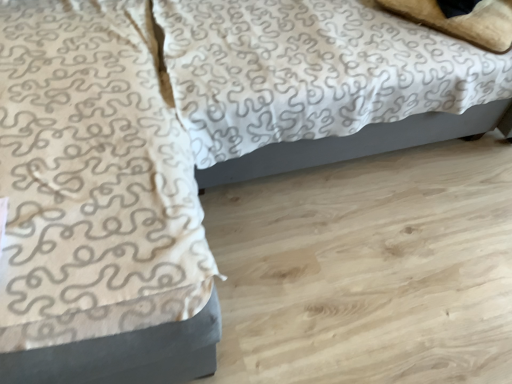
Question: Is white textured fabric at center at the back of beige soft pillow at upper right?

Choices:
 (A) yes
 (B) no

Answer: (A)

Question: Does beige soft pillow at upper right have a smaller size compared to white textured fabric at center?

Choices:
 (A) no
 (B) yes

Answer: (B)

Question: Considering the relative sizes of beige soft pillow at upper right and white textured fabric at center in the image provided, is beige soft pillow at upper right wider than white textured fabric at center?

Choices:
 (A) no
 (B) yes

Answer: (A)

Question: From a real-world perspective, is beige soft pillow at upper right on white textured fabric at center?

Choices:
 (A) yes
 (B) no

Answer: (A)

Question: From a real-world perspective, does beige soft pillow at upper right sit lower than white textured fabric at center?

Choices:
 (A) no
 (B) yes

Answer: (A)

Question: Looking at their shapes, would you say white textured blanket at upper left is wider or thinner than white textured fabric at center?

Choices:
 (A) wide
 (B) thin

Answer: (A)

Question: From a real-world perspective, is white textured blanket at upper left physically located above or below white textured fabric at center?

Choices:
 (A) below
 (B) above

Answer: (A)

Question: Visually, is white textured blanket at upper left positioned to the left or to the right of white textured fabric at center?

Choices:
 (A) right
 (B) left

Answer: (B)

Question: In the image, is white textured blanket at upper left positioned in front of or behind white textured fabric at center?

Choices:
 (A) behind
 (B) front

Answer: (B)

Question: Based on their sizes in the image, would you say beige soft pillow at upper right is bigger or smaller than white textured blanket at upper left?

Choices:
 (A) big
 (B) small

Answer: (B)

Question: Would you say beige soft pillow at upper right is to the left or to the right of white textured blanket at upper left in the picture?

Choices:
 (A) right
 (B) left

Answer: (A)

Question: Relative to white textured blanket at upper left, is beige soft pillow at upper right in front or behind?

Choices:
 (A) behind
 (B) front

Answer: (A)

Question: From a real-world perspective, is beige soft pillow at upper right positioned above or below white textured blanket at upper left?

Choices:
 (A) below
 (B) above

Answer: (B)

Question: In the image, is white textured fabric at center positioned in front of or behind white textured blanket at upper left?

Choices:
 (A) behind
 (B) front

Answer: (A)

Question: Considering the positions of white textured fabric at center and white textured blanket at upper left in the image, is white textured fabric at center taller or shorter than white textured blanket at upper left?

Choices:
 (A) short
 (B) tall

Answer: (B)